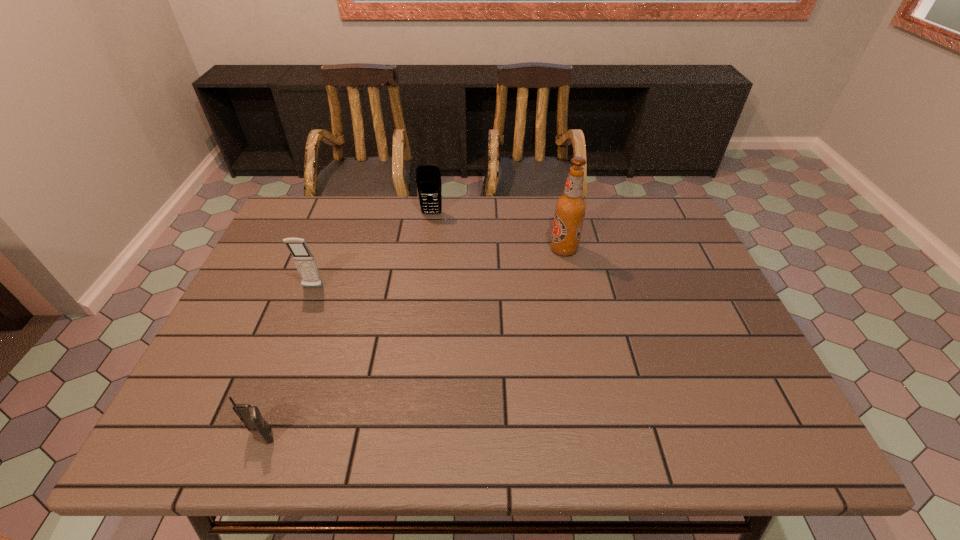
At what (x,y) coordinates should I click in order to perform the action: click on the rightmost object. Please return your answer as a coordinate pair (x, y). Image resolution: width=960 pixels, height=540 pixels. Looking at the image, I should click on (570, 208).

Where is `the third nearest object`? Image resolution: width=960 pixels, height=540 pixels. the third nearest object is located at coordinates (570, 208).

The image size is (960, 540). I want to click on the second nearest object, so click(304, 260).

Where is `the farthest object`? The height and width of the screenshot is (540, 960). the farthest object is located at coordinates (428, 178).

At what (x,y) coordinates should I click in order to perform the action: click on the rightmost cellular telephone. Please return your answer as a coordinate pair (x, y). Looking at the image, I should click on (428, 178).

Where is `the nearest object`? Image resolution: width=960 pixels, height=540 pixels. the nearest object is located at coordinates (250, 415).

Where is `the nearest cellular telephone`? This screenshot has height=540, width=960. the nearest cellular telephone is located at coordinates (250, 415).

Image resolution: width=960 pixels, height=540 pixels. Find the location of `vacant space situated 0.180m on the front label of the tallest object`. vacant space situated 0.180m on the front label of the tallest object is located at coordinates (488, 249).

Locate an element on the screen. The image size is (960, 540). free region located on the front label of the tallest object is located at coordinates (451, 249).

Identify the location of vacant space located 0.090m on the front label of the tallest object. (518, 249).